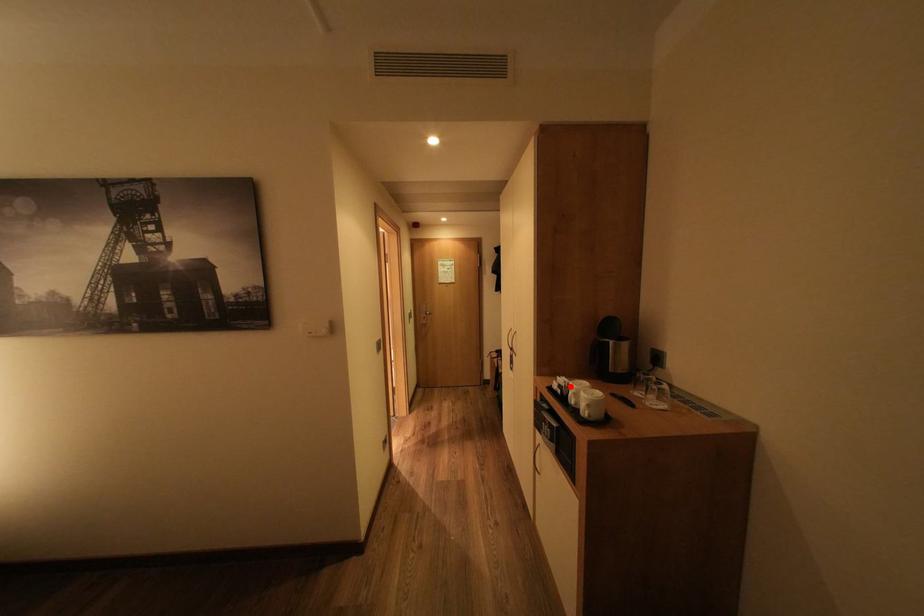
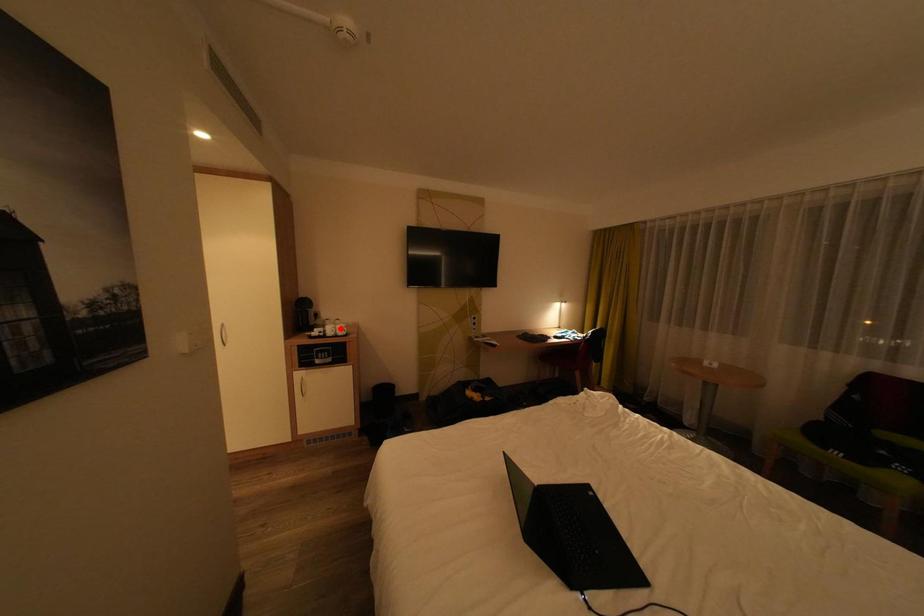
I am providing you with two images of the same scene from different viewpoints. A red point is marked on the first image and another point is marked on the second image. Is the red point in image1 aligned with the point shown in image2?

No